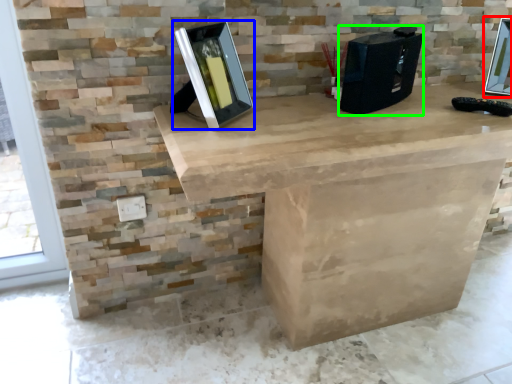
Question: Based on their relative distances, which object is farther from picture frame (highlighted by a red box)? Choose from picture frame (highlighted by a blue box) and desktop computer (highlighted by a green box).

Choices:
 (A) picture frame
 (B) desktop computer

Answer: (A)